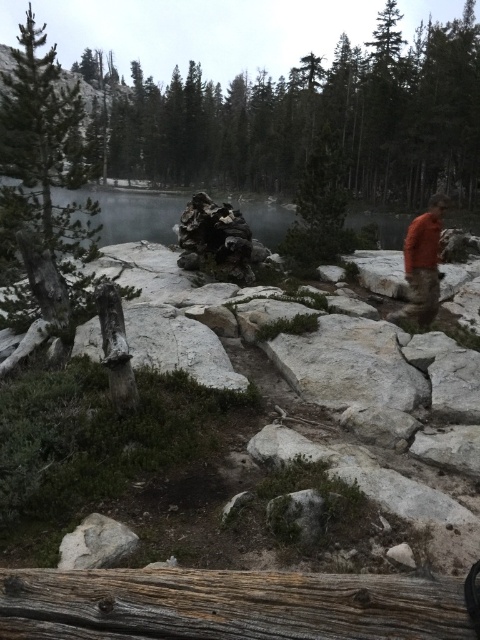
Based on the photo, can you confirm if dark green textured tree at left is positioned below orange fabric shirt at right?

No.

Describe the element at coordinates (43, 150) in the screenshot. I see `dark green textured tree at left` at that location.

Is point (39, 129) positioned in front of point (427, 248)?

No, (39, 129) is further to viewer.

This screenshot has height=640, width=480. Identify the location of dark green textured tree at left. (43, 150).

Who is positioned more to the right, dark green textured tree at left or clear water at lake center?

clear water at lake center

This screenshot has width=480, height=640. Describe the element at coordinates (43, 150) in the screenshot. I see `dark green textured tree at left` at that location.

What do you see at coordinates (43, 150) in the screenshot? This screenshot has height=640, width=480. I see `dark green textured tree at left` at bounding box center [43, 150].

Where is `dark green textured tree at left`? The width and height of the screenshot is (480, 640). dark green textured tree at left is located at coordinates (43, 150).

Measure the distance from weathered brown wood log at lower center to dark green textured tree at left.

9.64 meters

Is weathered brown wood log at lower center positioned before dark green textured tree at left?

Yes, it is in front of dark green textured tree at left.

This screenshot has height=640, width=480. In order to click on weathered brown wood log at lower center in this screenshot , I will do `click(228, 605)`.